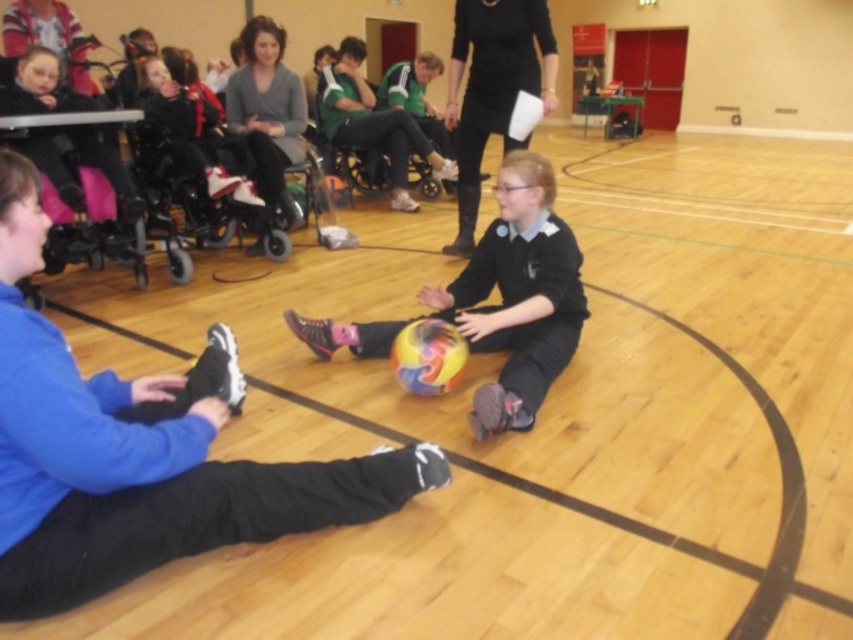
Is matte black wheelchair at upper left bigger than black plastic wheelchair at center?

Incorrect, matte black wheelchair at upper left is not larger than black plastic wheelchair at center.

Does matte black wheelchair at upper left have a lesser width compared to black plastic wheelchair at center?

Yes.

Find the location of a particular element. Image resolution: width=853 pixels, height=640 pixels. matte black wheelchair at upper left is located at coordinates (192, 129).

Is point (532, 356) in front of point (196, 161)?

Yes, it is.

Does multicolored rubber ball at center have a lesser width compared to matte black wheelchair at upper left?

In fact, multicolored rubber ball at center might be wider than matte black wheelchair at upper left.

Is point (505, 264) closer to camera compared to point (224, 192)?

Yes, it is.

The height and width of the screenshot is (640, 853). In order to click on multicolored rubber ball at center in this screenshot , I will do `click(517, 296)`.

Which is more to the left, multicolored rubber ball at center or grey sweater at upper center?

grey sweater at upper center is more to the left.

Does multicolored rubber ball at center appear on the left side of grey sweater at upper center?

Incorrect, multicolored rubber ball at center is not on the left side of grey sweater at upper center.

Locate an element on the screen. Image resolution: width=853 pixels, height=640 pixels. multicolored rubber ball at center is located at coordinates (517, 296).